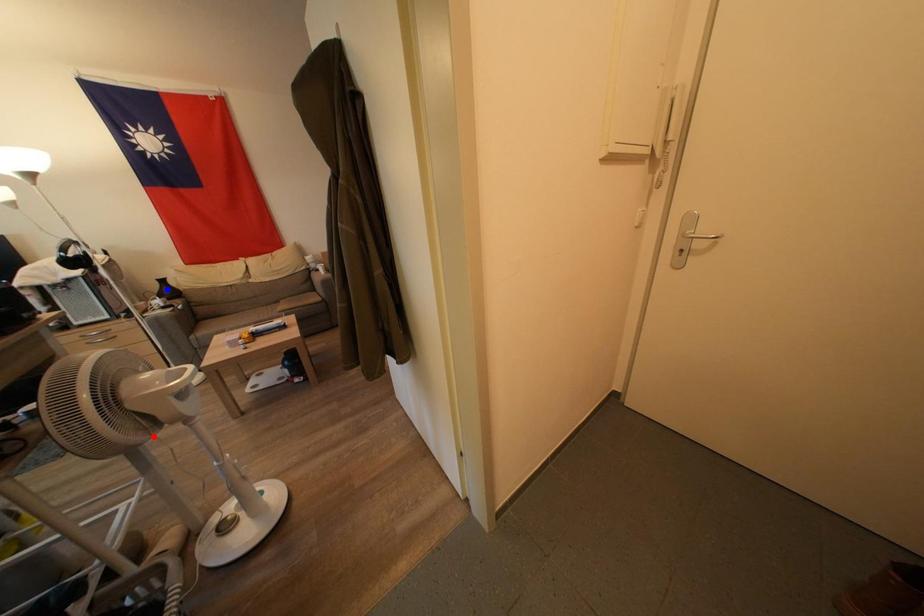
Question: Two points are marked on the image. Which point is closer to the camera?

Choices:
 (A) Blue point is closer.
 (B) Red point is closer.

Answer: (B)